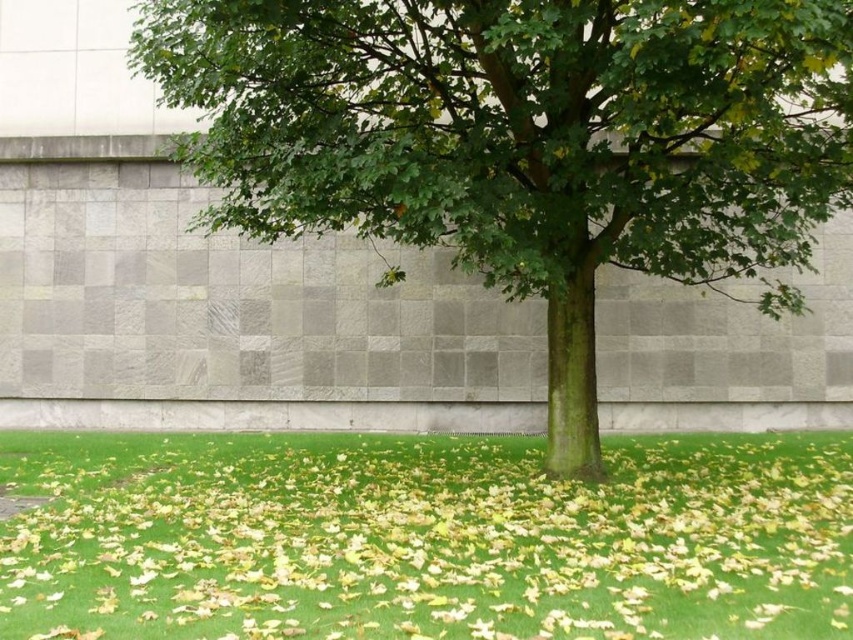
You are standing in the grassy area and want to walk towards the tree. Which direction should you move relative to the green grass at center to reach the green leafy tree at center?

The green leafy tree at center is to the right of the green grass at center, so you should move to the right relative to the green grass at center to reach the tree.

You are standing at the origin point in the image. The green leafy tree at center is located at coordinates 0.222 on the x axis and 0.614 on the y axis. If you want to walk directly towards the tree, which direction should you head?

To walk directly towards the green leafy tree at center located at coordinates x 0.222 and y 0.614, you should head northeast since the tree is positioned northeast of the origin point.